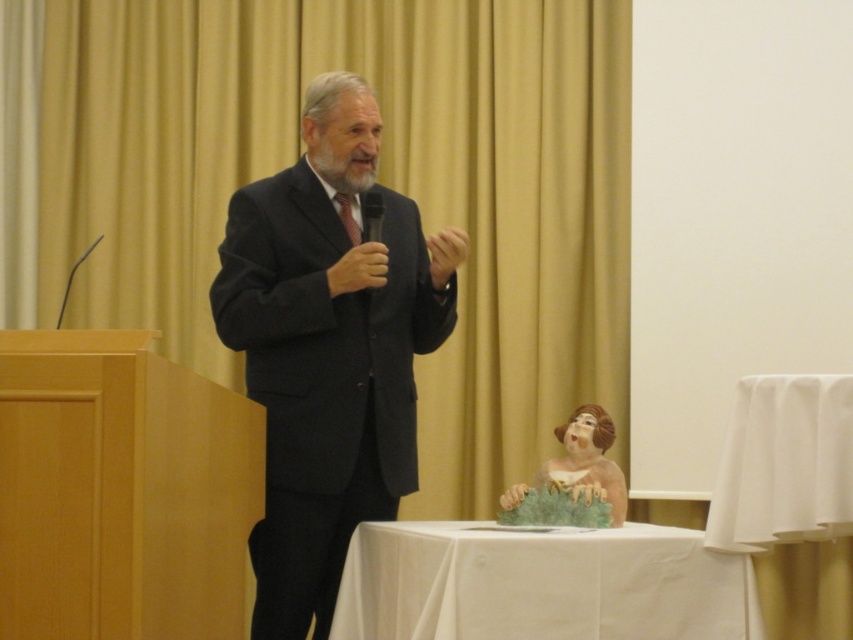
You are an event organizer setting up the stage for a presentation. You need to ensure that the matte yellow curtain at upper center and the black plastic microphone at center are visible to the audience. Based on their heights, which object might block the view of the other?

The matte yellow curtain at upper center has a greater height compared to the black plastic microphone at center, so the curtain could potentially block the view of the microphone if positioned in front of it.

You are an event organizer who needs to ensure the figurine on the white cloth at right is visible to the audience. The dark gray suit at center is blocking the view. Can you confirm if the figurine is currently visible to the audience?

The dark gray suit at center is positioned over white cloth at right, which means the figurine on the white cloth at right is likely blocked from view by the suit. The audience may not see it clearly.

You are an event planner setting up a stage for a presentation. The stage has a matte yellow curtain at upper center and a dark gray suit at center. You need to place a 3.5 feet wide decorative panel between them. Will there be enough space?

The matte yellow curtain at upper center and dark gray suit at center are 4.30 feet apart. Since the decorative panel is 3.5 feet wide, there is enough space between them to place it as 4.30 feet is greater than 3.5 feet.